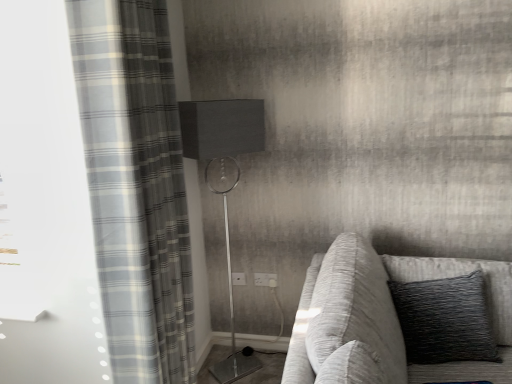
Question: From the image's perspective, is white plastic electric outlet at center, arranged as the second electric outlet when viewed from the right, located above textured gray fabric couch at right?

Choices:
 (A) yes
 (B) no

Answer: (A)

Question: Is white plastic electric outlet at center, arranged as the second electric outlet when viewed from the right, far from textured gray fabric couch at right?

Choices:
 (A) no
 (B) yes

Answer: (B)

Question: Can you see white plastic electric outlet at center, arranged as the second electric outlet when viewed from the right, touching textured gray fabric couch at right?

Choices:
 (A) no
 (B) yes

Answer: (A)

Question: Does white plastic electric outlet at center, arranged as the second electric outlet when viewed from the right, have a larger size compared to textured gray fabric couch at right?

Choices:
 (A) yes
 (B) no

Answer: (B)

Question: Can you confirm if white plastic electric outlet at center, the first electric outlet viewed from the left, is shorter than textured gray fabric couch at right?

Choices:
 (A) no
 (B) yes

Answer: (B)

Question: Does white plastic electric outlet at center, arranged as the second electric outlet when viewed from the right, lie in front of textured gray fabric couch at right?

Choices:
 (A) no
 (B) yes

Answer: (A)

Question: Considering the relative sizes of textured gray fabric couch at right and gray plaid curtain at left in the image provided, is textured gray fabric couch at right thinner than gray plaid curtain at left?

Choices:
 (A) no
 (B) yes

Answer: (A)

Question: Can you confirm if textured gray fabric couch at right is shorter than gray plaid curtain at left?

Choices:
 (A) no
 (B) yes

Answer: (B)

Question: Does textured gray fabric couch at right turn towards gray plaid curtain at left?

Choices:
 (A) no
 (B) yes

Answer: (A)

Question: From a real-world perspective, is textured gray fabric couch at right physically below gray plaid curtain at left?

Choices:
 (A) yes
 (B) no

Answer: (A)

Question: From the image's perspective, does textured gray fabric couch at right appear lower than gray plaid curtain at left?

Choices:
 (A) no
 (B) yes

Answer: (B)

Question: Is textured gray fabric couch at right to the right of gray plaid curtain at left from the viewer's perspective?

Choices:
 (A) yes
 (B) no

Answer: (A)

Question: Does white plastic electric outlet at center, the second electric outlet when ordered from left to right, have a greater height compared to textured gray fabric couch at right?

Choices:
 (A) no
 (B) yes

Answer: (A)